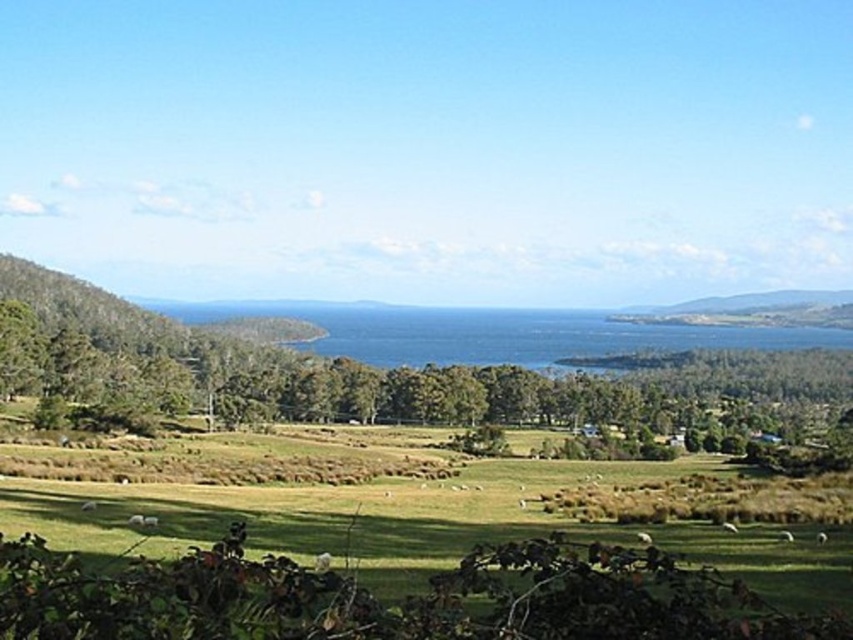
From the picture: Is green leafy tree at lower center wider than green grassy hillside at right?

Indeed, green leafy tree at lower center has a greater width compared to green grassy hillside at right.

Who is lower down, green leafy tree at lower center or green grassy hillside at right?

green leafy tree at lower center is below.

Between point (450, 410) and point (816, 301), which one is positioned behind?

Point (816, 301)

At what (x,y) coordinates should I click in order to perform the action: click on green leafy tree at lower center. Please return your answer as a coordinate pair (x, y). The image size is (853, 640). Looking at the image, I should click on (428, 380).